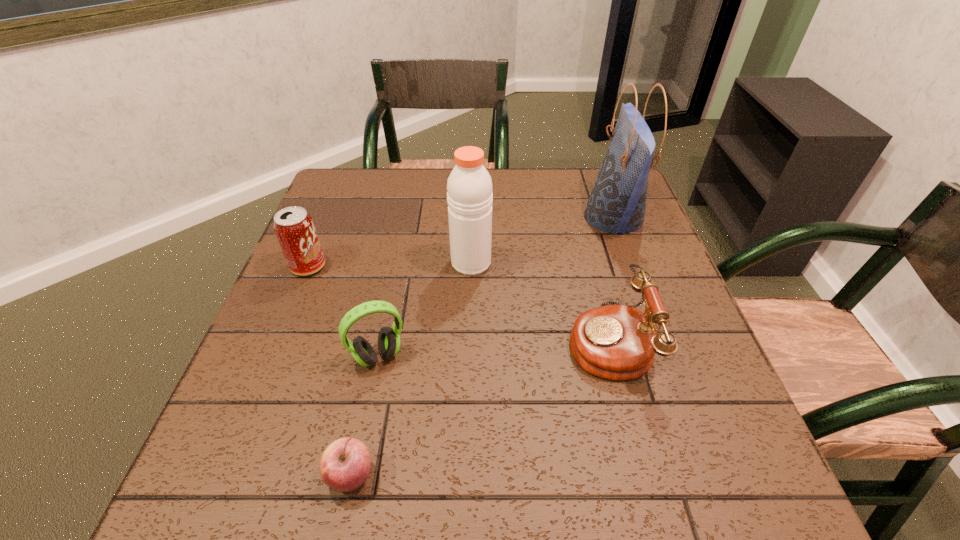
Locate an element on the screen. free spot located on the right of the shaker is located at coordinates (519, 262).

The height and width of the screenshot is (540, 960). Identify the location of free space located on the front of the soda can. (259, 385).

Locate an element on the screen. Image resolution: width=960 pixels, height=540 pixels. free space located 0.270m on the dial of the telephone is located at coordinates (438, 340).

This screenshot has height=540, width=960. I want to click on blank space located on the dial of the telephone, so click(x=423, y=340).

Where is `free spot located 0.300m on the dial of the telephone`? free spot located 0.300m on the dial of the telephone is located at coordinates (423, 340).

Image resolution: width=960 pixels, height=540 pixels. I want to click on vacant point located 0.060m on the front of the headset, so click(x=370, y=401).

Locate an element on the screen. This screenshot has width=960, height=540. vacant space located 0.150m on the back of the nearest object is located at coordinates (372, 376).

This screenshot has height=540, width=960. What are the coordinates of `object located at the far edge` in the screenshot? It's located at (617, 203).

At what (x,y) coordinates should I click in order to perform the action: click on object that is at the near edge. Please return your answer as a coordinate pair (x, y). The height and width of the screenshot is (540, 960). Looking at the image, I should click on (345, 465).

Image resolution: width=960 pixels, height=540 pixels. What are the coordinates of `object that is positioned at the left edge` in the screenshot? It's located at (294, 228).